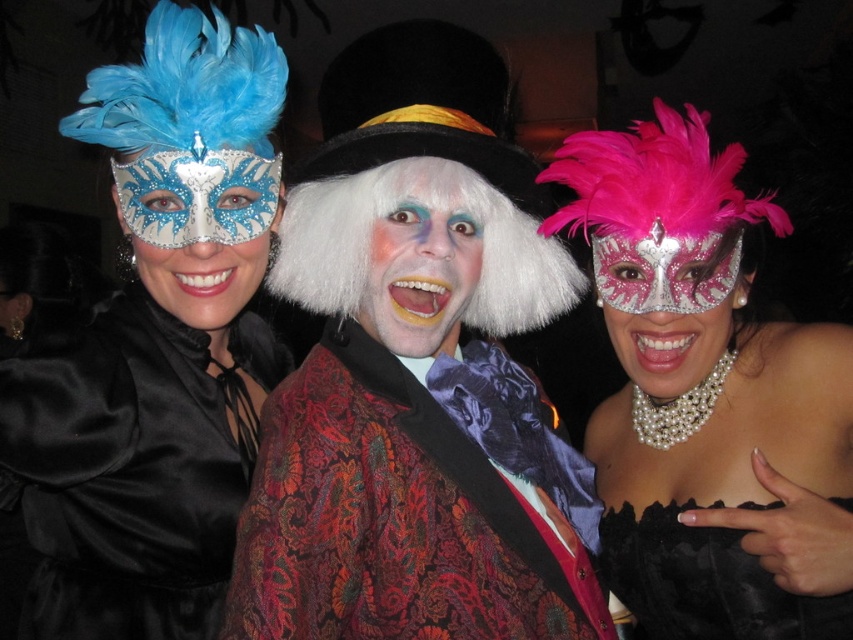
Which of these two, satin mask at left or matte silver mask at center, stands taller?

satin mask at left is taller.

Describe the element at coordinates (157, 348) in the screenshot. Image resolution: width=853 pixels, height=640 pixels. I see `satin mask at left` at that location.

Does point (149, 422) come behind point (196, 300)?

No, it is not.

Locate an element on the screen. This screenshot has height=640, width=853. satin mask at left is located at coordinates (157, 348).

Does pearl necklace at center have a lesser width compared to matte silver mask at center?

Incorrect, pearl necklace at center's width is not less than matte silver mask at center's.

Which is below, pearl necklace at center or matte silver mask at center?

pearl necklace at center is below.

What are the coordinates of `pearl necklace at center` in the screenshot? It's located at (703, 392).

You are a GUI agent. You are given a task and a screenshot of the screen. Output one action in this format:
    pyautogui.click(x=<x>, y=<y>)
    Task: Click on the pearl necklace at center
    The width and height of the screenshot is (853, 640).
    Given the screenshot: What is the action you would take?
    pyautogui.click(x=703, y=392)

Does pearl necklace at center have a lesser width compared to black lace corset at center?

Incorrect, pearl necklace at center's width is not less than black lace corset at center's.

Does point (747, 518) come farther from viewer compared to point (683, 636)?

That is False.

You are a GUI agent. You are given a task and a screenshot of the screen. Output one action in this format:
    pyautogui.click(x=<x>, y=<y>)
    Task: Click on the pearl necklace at center
    The image size is (853, 640).
    Given the screenshot: What is the action you would take?
    pyautogui.click(x=703, y=392)